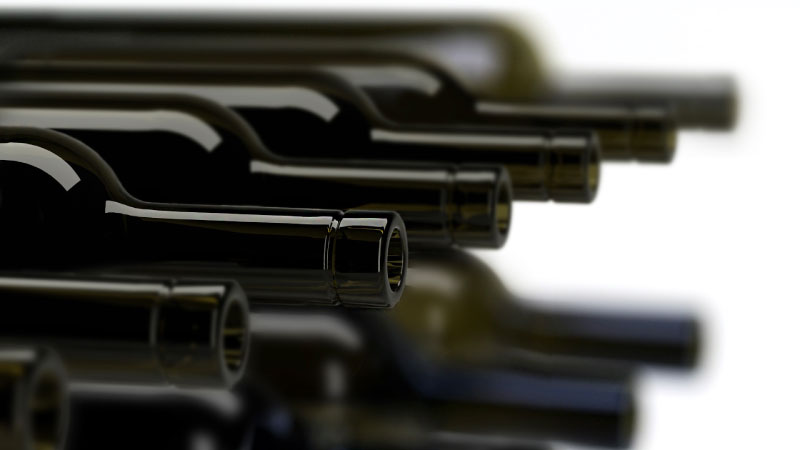
Find the location of `wine bottles`. wine bottles is located at coordinates (45, 377), (190, 312), (306, 235), (434, 189), (522, 153), (604, 126), (705, 86), (628, 325), (560, 401), (190, 431).